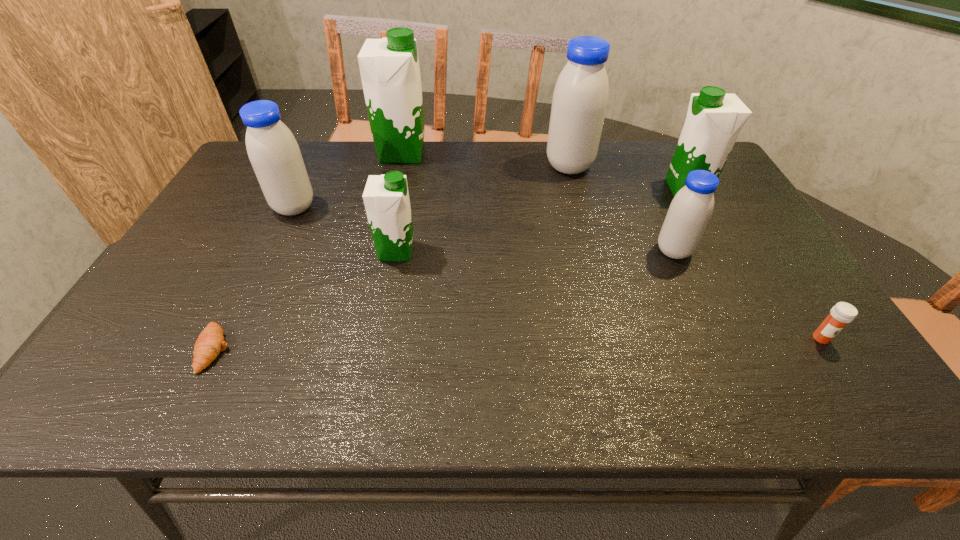
Locate an element on the screen. This screenshot has width=960, height=540. the farthest green soya milk is located at coordinates (389, 67).

The width and height of the screenshot is (960, 540). Identify the location of the second blue soya milk from right to left. (580, 98).

I want to click on the fourth soya milk from left to right, so click(580, 98).

This screenshot has width=960, height=540. What are the coordinates of `the second object from right to left` in the screenshot? It's located at [714, 119].

At what (x,y) coordinates should I click in order to perform the action: click on the second smallest green soya milk. Please return your answer as a coordinate pair (x, y). This screenshot has height=540, width=960. Looking at the image, I should click on (714, 119).

The image size is (960, 540). Find the location of `the second farthest blue soya milk`. the second farthest blue soya milk is located at coordinates (273, 151).

Find the location of a particular element. the second smallest blue soya milk is located at coordinates (273, 151).

What are the coordinates of `the smallest green soya milk` in the screenshot? It's located at (386, 198).

Identify the location of the smallest blue soya milk. (691, 209).

Identify the location of the second soya milk from right to left. This screenshot has height=540, width=960. (691, 209).